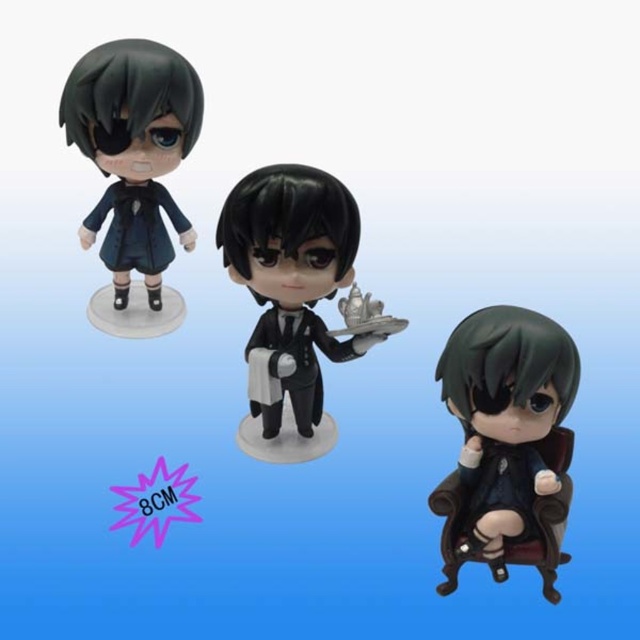
Does point (509, 307) come in front of point (88, 221)?

Yes.

Can you confirm if satin black figurine at center is thinner than matte black coat at upper left?

Yes, satin black figurine at center is thinner than matte black coat at upper left.

Which is behind, point (461, 397) or point (124, 180)?

The point (124, 180) is behind.

This screenshot has height=640, width=640. Find the location of `satin black figurine at center`. satin black figurine at center is located at coordinates (506, 442).

Measure the distance from matte black figurine at center to matte black coat at upper left.

matte black figurine at center and matte black coat at upper left are 15.83 inches apart from each other.

Is matte black figurine at center below matte black coat at upper left?

Correct, matte black figurine at center is located below matte black coat at upper left.

Image resolution: width=640 pixels, height=640 pixels. I want to click on matte black figurine at center, so click(x=291, y=298).

Find the location of a particular element. This screenshot has width=640, height=640. matte black figurine at center is located at coordinates (291, 298).

Can you confirm if matte black doll at upper left is wider than matte black coat at upper left?

Correct, the width of matte black doll at upper left exceeds that of matte black coat at upper left.

Is matte black doll at upper left taller than matte black coat at upper left?

Yes, matte black doll at upper left is taller than matte black coat at upper left.

Locate an element on the screen. Image resolution: width=640 pixels, height=640 pixels. matte black doll at upper left is located at coordinates (132, 150).

The width and height of the screenshot is (640, 640). I want to click on matte black doll at upper left, so click(x=132, y=150).